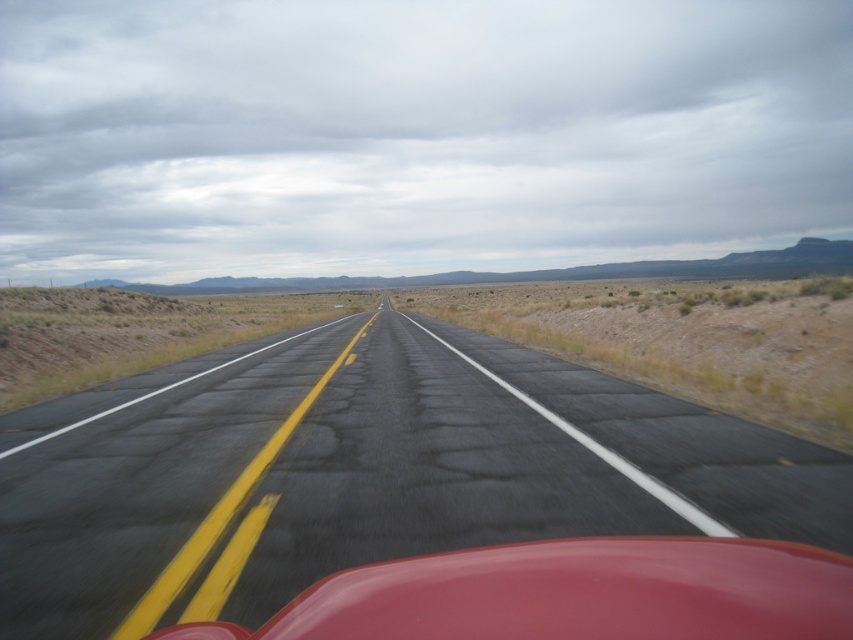
You are driving a glossy red car at center on a long asphalt road at center. You want to pass another vehicle on the same road. Based on the road and car dimensions, is there enough space to safely change lanes without crossing the solid yellow line?

The asphalt road at center is wider than the glossy red car at center, so there is enough space to safely change lanes without crossing the solid yellow line.

You are driving a car and see the glossy red car at center ahead on the asphalt road at center. According to the scene, which side of the road should you stay on to legally drive in this country where vehicles drive on the left side of the road?

Since the asphalt road at center is to the left of the glossy red car at center, you should stay on the left side of the asphalt road at center to legally drive in this country where vehicles drive on the left side of the road.

You are a driver approaching the road in the image. There is a point marked at coordinates [410,500]. Is this point located on the asphalt road at the center of the image?

Yes, the point marked at [410,500] is located on the asphalt road at the center of the image.